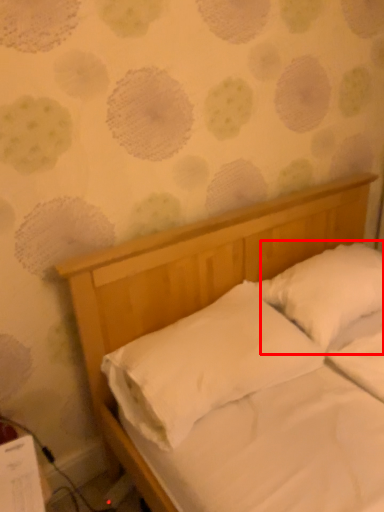
Question: From the image's perspective, considering the relative positions of pillow (annotated by the red box) and pillow in the image provided, where is pillow (annotated by the red box) located with respect to the staircase?

Choices:
 (A) above
 (B) below

Answer: (A)